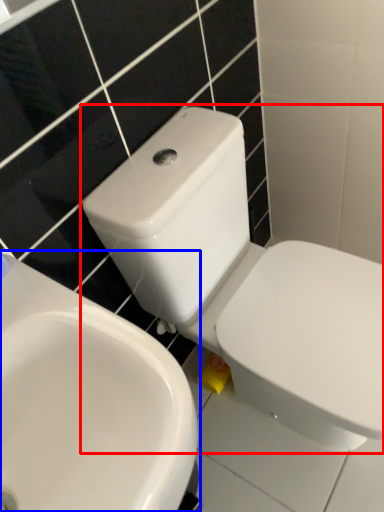
Question: Which of the following is the farthest to the observer, toilet (highlighted by a red box) or sink (highlighted by a blue box)?

Choices:
 (A) toilet
 (B) sink

Answer: (A)